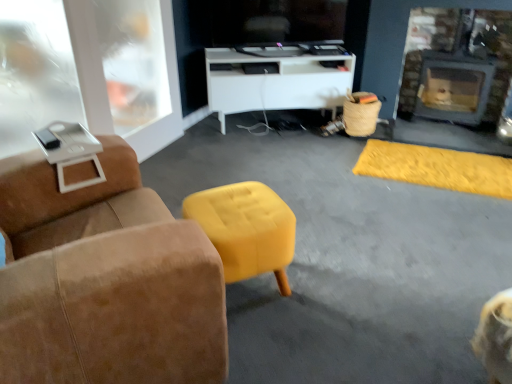
At what (x,y) coordinates should I click in order to perform the action: click on free point above yellow fabric stool at center (from a real-world perspective). Please return your answer as a coordinate pair (x, y). The width and height of the screenshot is (512, 384). Looking at the image, I should click on 237,211.